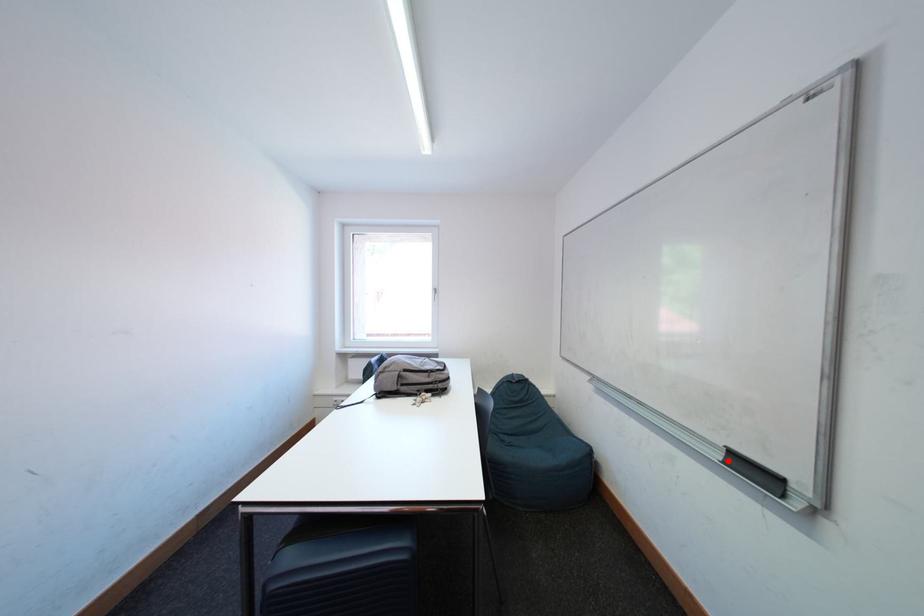
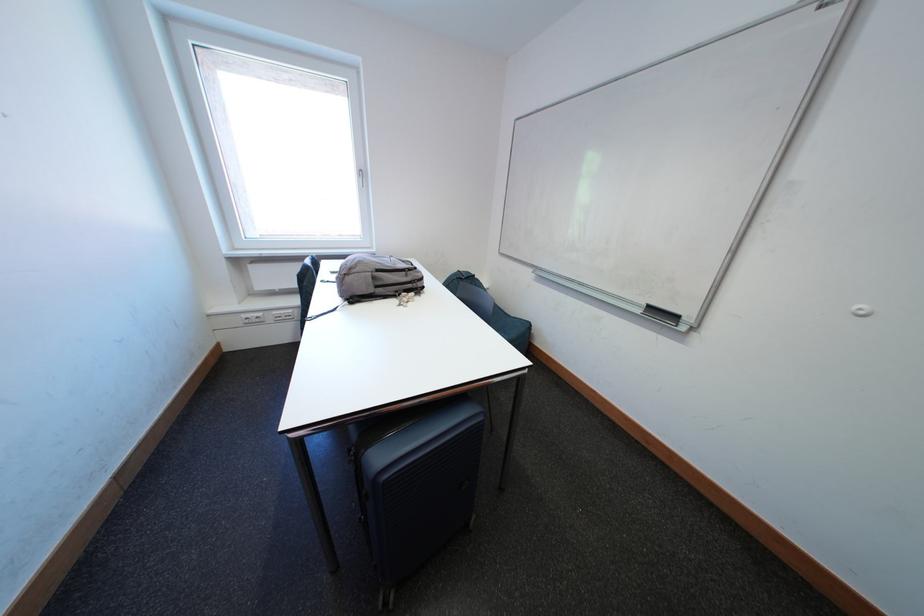
Question: I am providing you with two images of the same scene from different viewpoints. In image1, a red point is highlighted. Considering the same 3D point in image2, which of the following is correct?

Choices:
 (A) It is closer
 (B) It is farther

Answer: (A)